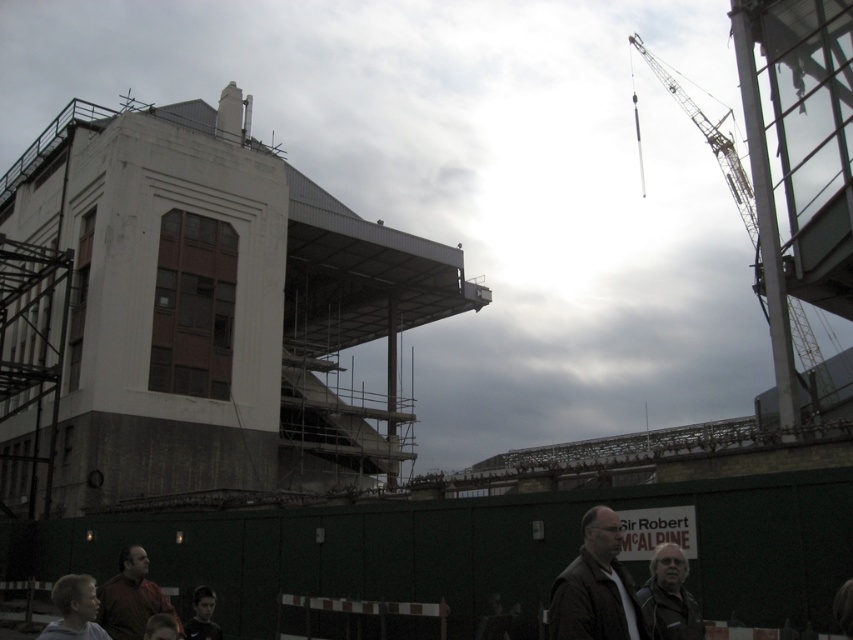
You are a safety inspector on the construction site. You need to ensure that the yellow metallic crane at upper right is positioned safely away from the white concrete building at left. Based on their positions in the image, can you determine if the crane is at a safe height above the building?

The white concrete building at left is below the yellow metallic crane at upper right, so the crane is positioned at a safe height above the building.